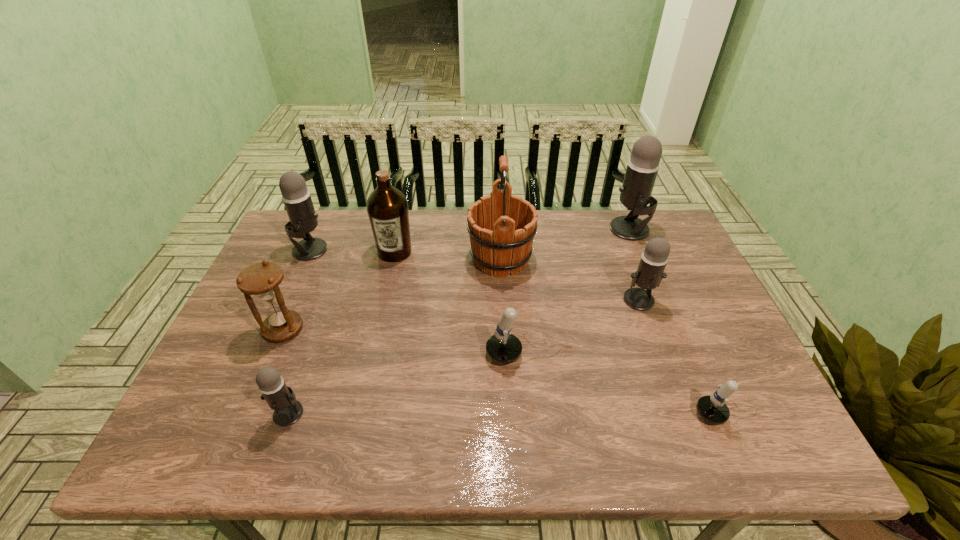
Where is `wine bucket`? The width and height of the screenshot is (960, 540). wine bucket is located at coordinates point(501,226).

Locate an element on the screen. This screenshot has height=540, width=960. the tallest microphone is located at coordinates (635, 193).

You are a GUI agent. You are given a task and a screenshot of the screen. Output one action in this format:
    pyautogui.click(x=<x>, y=<y>)
    Task: Click on the olive oil
    
    Given the screenshot: What is the action you would take?
    point(387,207)

The width and height of the screenshot is (960, 540). I want to click on brown olive oil, so click(387, 207).

This screenshot has height=540, width=960. Find the location of `the second tallest microphone`. the second tallest microphone is located at coordinates (296, 197).

Image resolution: width=960 pixels, height=540 pixels. Find the location of `the leftmost microphone`. the leftmost microphone is located at coordinates (296, 197).

Image resolution: width=960 pixels, height=540 pixels. Identify the location of the third biggest gray microphone. (649, 274).

Find the location of a particular element. The image size is (960, 540). the fifth nearest object is located at coordinates (649, 274).

This screenshot has width=960, height=540. What are the coordinates of `hourglass` in the screenshot? It's located at (261, 279).

This screenshot has height=540, width=960. I want to click on the third microphone from left to right, so click(503, 347).